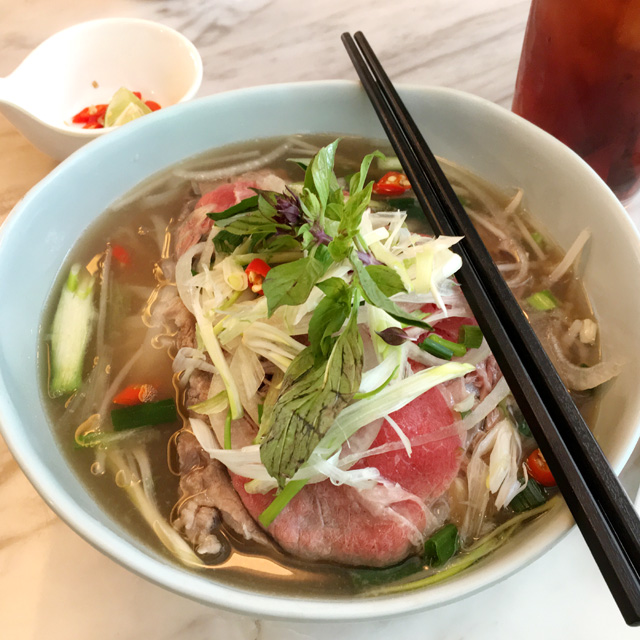
Image resolution: width=640 pixels, height=640 pixels. I want to click on bowl, so click(320, 109).